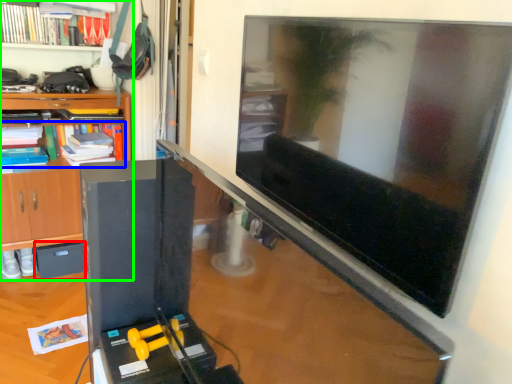
Question: Based on their relative distances, which object is farther from drawer (highlighted by a red box)? Choose from book (highlighted by a blue box) and shelf (highlighted by a green box).

Choices:
 (A) book
 (B) shelf

Answer: (A)